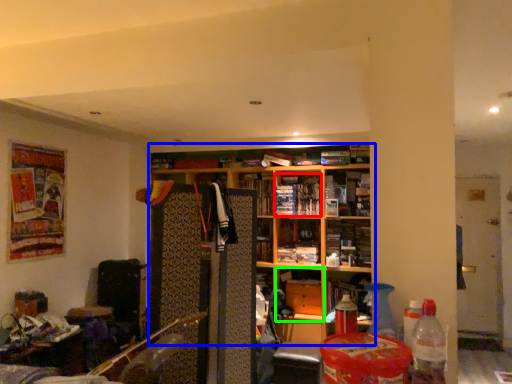
Question: Which object is the closest to the book (highlighted by a red box)? Choose among these: shelf (highlighted by a blue box) or cabinet (highlighted by a green box).

Choices:
 (A) shelf
 (B) cabinet

Answer: (A)